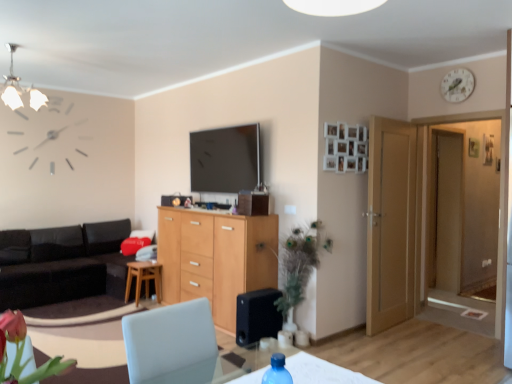
Question: Is transparent glass door at right at the back of black matte speaker at lower center?

Choices:
 (A) yes
 (B) no

Answer: (B)

Question: Considering the relative positions of black matte speaker at lower center and transparent glass door at right in the image provided, is black matte speaker at lower center to the right of transparent glass door at right from the viewer's perspective?

Choices:
 (A) no
 (B) yes

Answer: (A)

Question: From a real-world perspective, is black matte speaker at lower center below transparent glass door at right?

Choices:
 (A) no
 (B) yes

Answer: (B)

Question: Does black matte speaker at lower center touch transparent glass door at right?

Choices:
 (A) no
 (B) yes

Answer: (A)

Question: Is the depth of black matte speaker at lower center less than that of transparent glass door at right?

Choices:
 (A) no
 (B) yes

Answer: (B)

Question: In the image, is black leather couch at left positioned in front of or behind wooden stool at center?

Choices:
 (A) behind
 (B) front

Answer: (B)

Question: Is black leather couch at left taller or shorter than wooden stool at center?

Choices:
 (A) tall
 (B) short

Answer: (A)

Question: In the image, is black leather couch at left on the left side or the right side of wooden stool at center?

Choices:
 (A) left
 (B) right

Answer: (A)

Question: From a real-world perspective, is black leather couch at left physically located above or below wooden stool at center?

Choices:
 (A) below
 (B) above

Answer: (B)

Question: From the image's perspective, is black leather couch at left positioned above or below black matte speaker at lower center?

Choices:
 (A) above
 (B) below

Answer: (A)

Question: Is black leather couch at left bigger or smaller than black matte speaker at lower center?

Choices:
 (A) big
 (B) small

Answer: (A)

Question: Relative to black matte speaker at lower center, is black leather couch at left in front or behind?

Choices:
 (A) behind
 (B) front

Answer: (A)

Question: Considering the relative positions of black leather couch at left and black matte speaker at lower center in the image provided, is black leather couch at left to the left or to the right of black matte speaker at lower center?

Choices:
 (A) left
 (B) right

Answer: (A)

Question: Is point (287, 299) positioned closer to the camera than point (131, 273)?

Choices:
 (A) farther
 (B) closer

Answer: (B)

Question: Would you say green leafy plant at center is inside or outside wooden stool at center?

Choices:
 (A) inside
 (B) outside

Answer: (B)